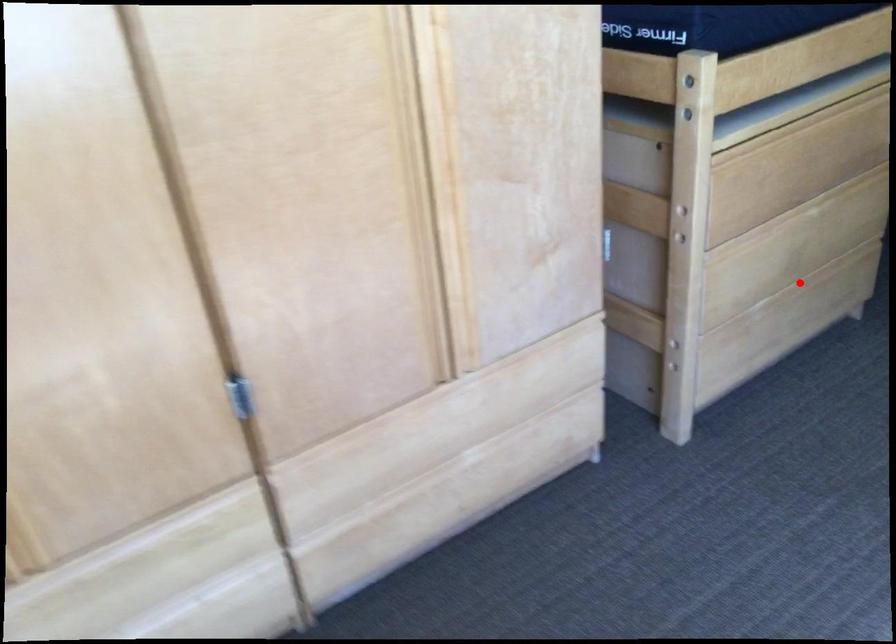
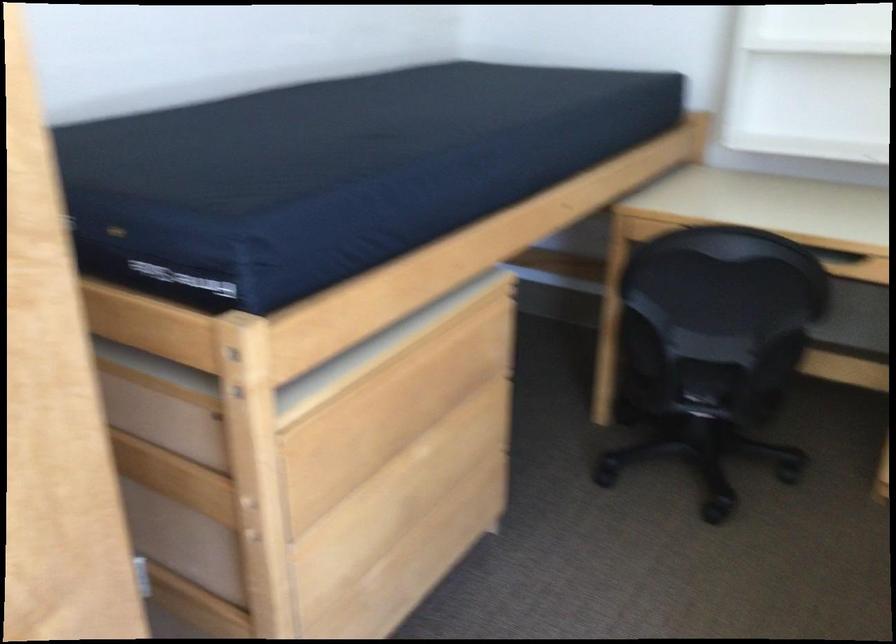
Question: I am providing you with two images of the same scene from different viewpoints. In image1, a red point is highlighted. Considering the same 3D point in image2, which of the following is correct?

Choices:
 (A) It is closer
 (B) It is farther

Answer: (A)